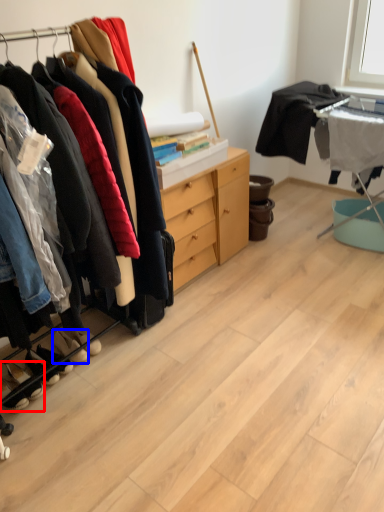
Question: Which object is closer to the camera taking this photo, footwear (highlighted by a red box) or footwear (highlighted by a blue box)?

Choices:
 (A) footwear
 (B) footwear

Answer: (A)